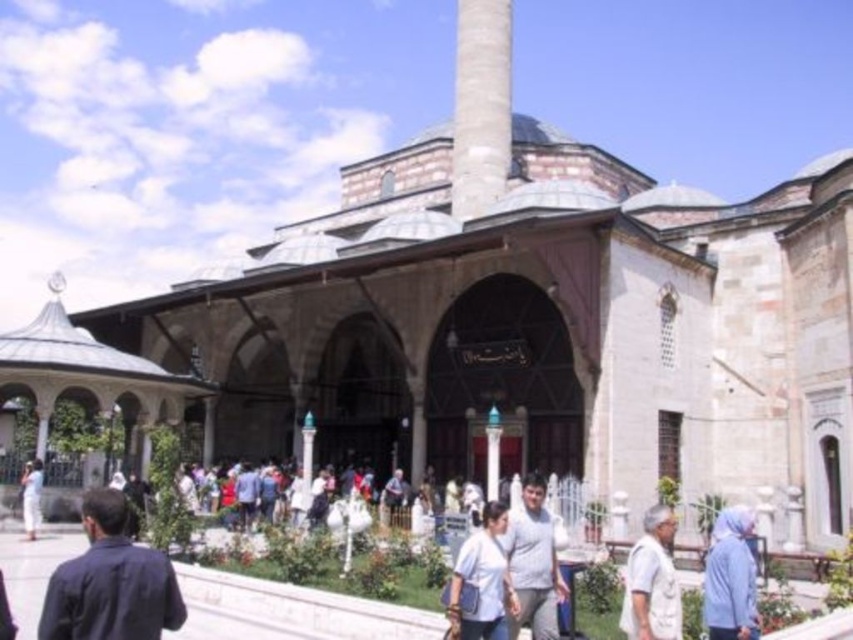
You are standing in front of the grand mosque and want to take a photo of the intricate arched entrance. There is a person wearing a dark blue shirt at lower left in your view. Where should you position yourself to avoid capturing the person in the photo?

To avoid capturing the dark blue shirt at lower left in your photo, position yourself so that the dark blue shirt at lower left is outside the frame. Since the dark blue shirt at lower left is located at the lower left corner of the image, moving slightly to the right or upward could help exclude it from the shot.